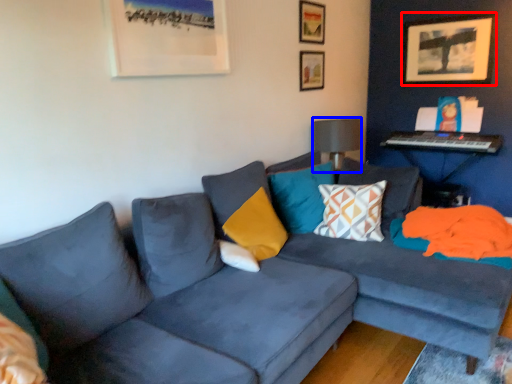
Question: Among these objects, which one is nearest to the camera, picture frame (highlighted by a red box) or lamp (highlighted by a blue box)?

Choices:
 (A) picture frame
 (B) lamp

Answer: (B)